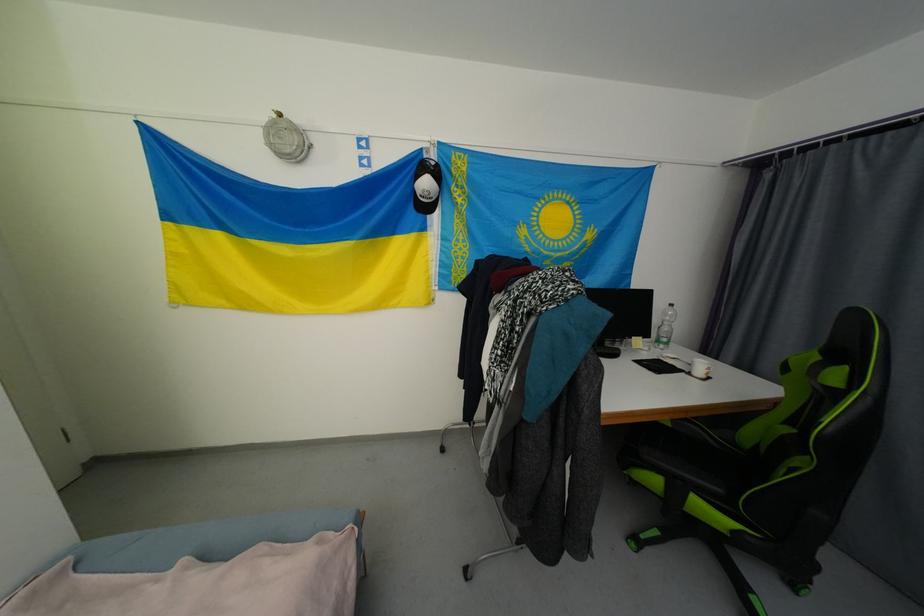
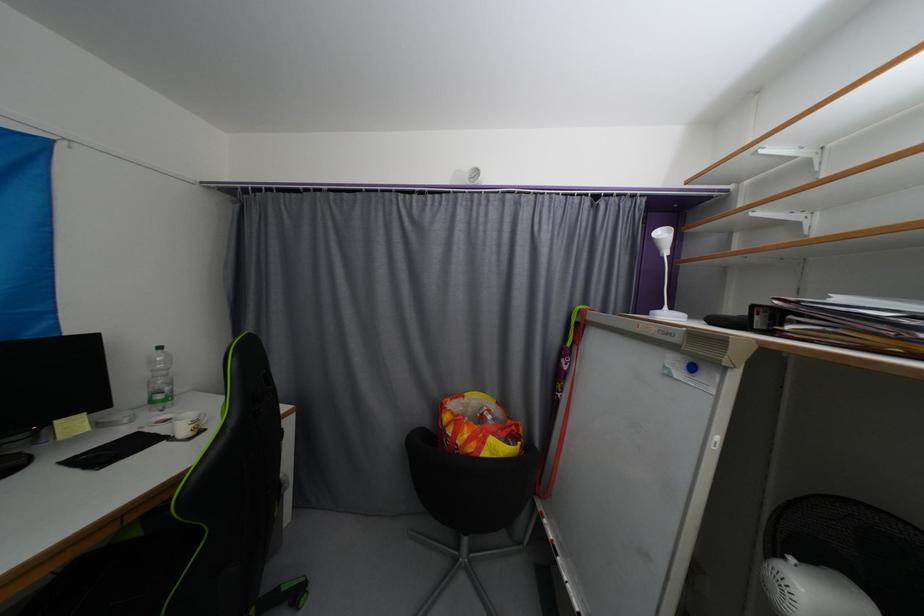
The point at (x=663, y=344) is marked in the first image. Where is the corresponding point in the second image?

(157, 403)